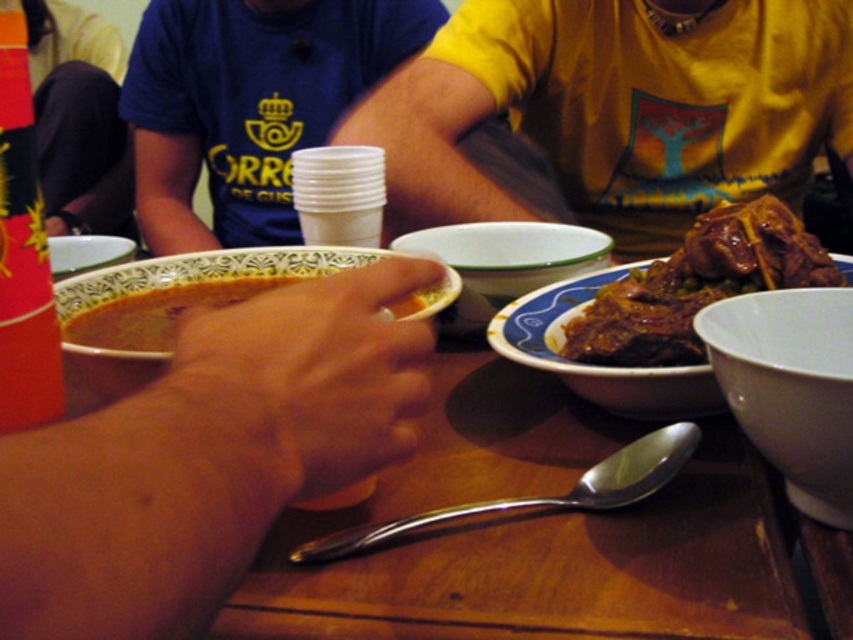
Question: Which object appears closest to the camera in this image?

Choices:
 (A) red matte cup at left
 (B) brown glossy meat at right

Answer: (A)

Question: Can you confirm if white ceramic bowl at center is positioned to the right of matte ceramic bowl at upper left?

Choices:
 (A) no
 (B) yes

Answer: (B)

Question: Among these points, which one is farthest from the camera?

Choices:
 (A) (357, 252)
 (B) (51, 275)

Answer: (A)

Question: Does matte ceramic bowl at center have a smaller size compared to matte ceramic bowl at upper left?

Choices:
 (A) no
 (B) yes

Answer: (A)

Question: Is matte ceramic bowl at center positioned in front of white glossy bowl at center?

Choices:
 (A) yes
 (B) no

Answer: (A)

Question: Which object is the farthest from the white ceramic bowl at center?

Choices:
 (A) yellow matte shirt at upper right
 (B) white glossy bowl at center
 (C) brown glossy meat at right
 (D) red matte cup at left

Answer: (A)